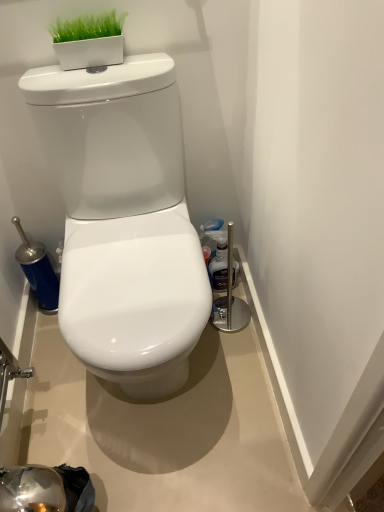
Where is `free space in front of clear plastic bottle at right`? The height and width of the screenshot is (512, 384). free space in front of clear plastic bottle at right is located at coordinates (230, 321).